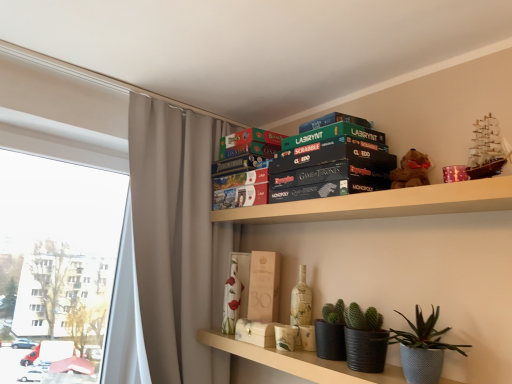
Question: Is matte black pots at lower center, the first shelf ordered from the bottom, surrounding white textured vase at center, the 1th paperback book in the left-to-right sequence?

Choices:
 (A) yes
 (B) no

Answer: (B)

Question: Can you confirm if matte black pots at lower center, which appears as the 2th shelf when viewed from the top, is wider than white textured vase at center, the 1th paperback book in the left-to-right sequence?

Choices:
 (A) no
 (B) yes

Answer: (B)

Question: Is matte black pots at lower center, the first shelf ordered from the bottom, positioned before white textured vase at center, the 1th paperback book when ordered from bottom to top?

Choices:
 (A) no
 (B) yes

Answer: (B)

Question: Is matte black pots at lower center, which appears as the 2th shelf when viewed from the top, far away from white textured vase at center, positioned as the third paperback book in top-to-bottom order?

Choices:
 (A) no
 (B) yes

Answer: (A)

Question: From a real-world perspective, is matte black pots at lower center, the first shelf ordered from the bottom, under white textured vase at center, the 1th paperback book when ordered from bottom to top?

Choices:
 (A) no
 (B) yes

Answer: (B)

Question: Considering the positions of black cardboard game box at upper center and green matte board game at upper center, the 3th paperback book ordered from the bottom, in the image, is black cardboard game box at upper center taller or shorter than green matte board game at upper center, the 3th paperback book ordered from the bottom,?

Choices:
 (A) tall
 (B) short

Answer: (A)

Question: From a real-world perspective, is black cardboard game box at upper center above or below green matte board game at upper center, marked as the 1th paperback book in a top-to-bottom arrangement?

Choices:
 (A) above
 (B) below

Answer: (B)

Question: From the image's perspective, is black cardboard game box at upper center positioned above or below green matte board game at upper center, which is counted as the first paperback book, starting from the right?

Choices:
 (A) below
 (B) above

Answer: (A)

Question: Visually, is black cardboard game box at upper center positioned to the left or to the right of green matte board game at upper center, the 3th paperback book ordered from the bottom?

Choices:
 (A) left
 (B) right

Answer: (A)

Question: Is brown plush bear at upper right wider or thinner than green matte board game at upper center, the 3th paperback book ordered from the bottom?

Choices:
 (A) wide
 (B) thin

Answer: (B)

Question: Do you think brown plush bear at upper right is within green matte board game at upper center, positioned as the third paperback book in left-to-right order, or outside of it?

Choices:
 (A) outside
 (B) inside

Answer: (A)

Question: Is point (409, 155) positioned closer to the camera than point (373, 137)?

Choices:
 (A) closer
 (B) farther

Answer: (A)

Question: From a real-world perspective, is brown plush bear at upper right above or below green matte board game at upper center, positioned as the third paperback book in left-to-right order?

Choices:
 (A) below
 (B) above

Answer: (A)

Question: Based on their sizes in the image, would you say wooden box at center, the 2th paperback book ordered from the bottom, is bigger or smaller than wooden board game boxes at upper center, placed as the 2th shelf when sorted from bottom to top?

Choices:
 (A) big
 (B) small

Answer: (B)

Question: Looking at their shapes, would you say wooden box at center, the 2th paperback book ordered from the bottom, is wider or thinner than wooden board game boxes at upper center, the first shelf from the top?

Choices:
 (A) thin
 (B) wide

Answer: (A)